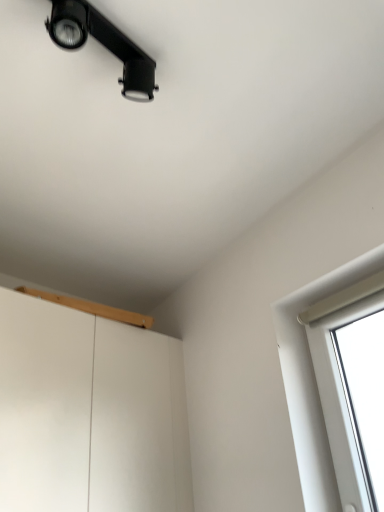
Question: Considering the relative positions of light wood/wooden window sill at upper center and black matte track light at upper left in the image provided, is light wood/wooden window sill at upper center to the left of black matte track light at upper left from the viewer's perspective?

Choices:
 (A) yes
 (B) no

Answer: (A)

Question: Does light wood/wooden window sill at upper center lie in front of black matte track light at upper left?

Choices:
 (A) yes
 (B) no

Answer: (B)

Question: Can you confirm if light wood/wooden window sill at upper center is taller than black matte track light at upper left?

Choices:
 (A) yes
 (B) no

Answer: (B)

Question: Is light wood/wooden window sill at upper center beside black matte track light at upper left?

Choices:
 (A) no
 (B) yes

Answer: (A)

Question: Is light wood/wooden window sill at upper center positioned with its back to black matte track light at upper left?

Choices:
 (A) no
 (B) yes

Answer: (A)

Question: Is light wood/wooden window sill at upper center positioned behind black matte track light at upper left?

Choices:
 (A) no
 (B) yes

Answer: (B)

Question: Are black matte track light at upper left and light wood/wooden window sill at upper center making contact?

Choices:
 (A) yes
 (B) no

Answer: (B)

Question: Is black matte track light at upper left surrounding light wood/wooden window sill at upper center?

Choices:
 (A) yes
 (B) no

Answer: (B)

Question: Is black matte track light at upper left smaller than light wood/wooden window sill at upper center?

Choices:
 (A) no
 (B) yes

Answer: (B)

Question: Considering the relative sizes of black matte track light at upper left and light wood/wooden window sill at upper center in the image provided, is black matte track light at upper left shorter than light wood/wooden window sill at upper center?

Choices:
 (A) yes
 (B) no

Answer: (B)

Question: Considering the relative sizes of black matte track light at upper left and light wood/wooden window sill at upper center in the image provided, is black matte track light at upper left thinner than light wood/wooden window sill at upper center?

Choices:
 (A) no
 (B) yes

Answer: (B)

Question: Is black matte track light at upper left oriented towards light wood/wooden window sill at upper center?

Choices:
 (A) yes
 (B) no

Answer: (B)

Question: Considering the positions of black matte track light at upper left and light wood/wooden window sill at upper center in the image, is black matte track light at upper left wider or thinner than light wood/wooden window sill at upper center?

Choices:
 (A) thin
 (B) wide

Answer: (A)